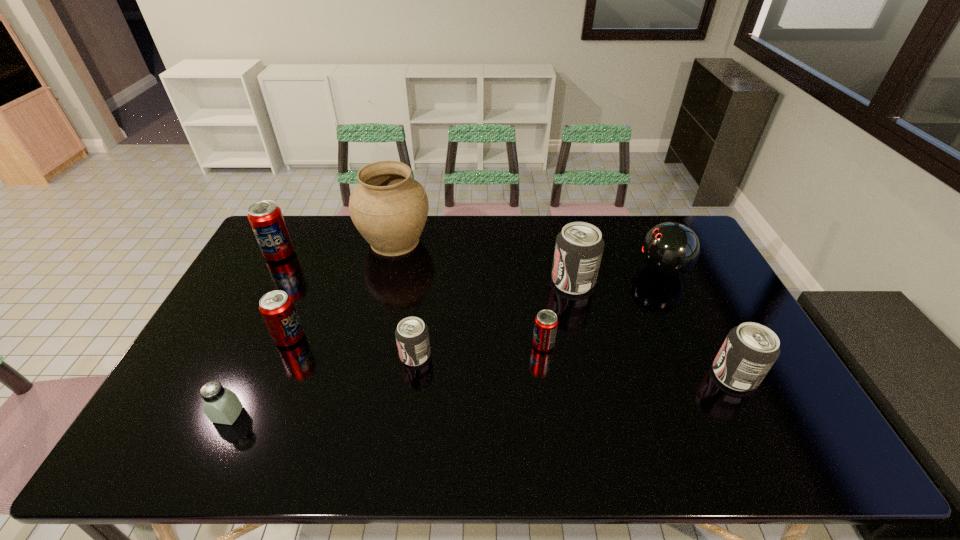
Image resolution: width=960 pixels, height=540 pixels. Find the location of `vacant area at the near left corner`. vacant area at the near left corner is located at coordinates [148, 441].

The width and height of the screenshot is (960, 540). In order to click on free space between the leftmost red soda can and the fourth soda can from right to left in this screenshot , I will do `click(348, 305)`.

Identify the location of free space between the leftmost soda can and the nearest object. This screenshot has width=960, height=540. (253, 334).

Identify the location of free space between the leftmost soda can and the third soda can from right to left. This screenshot has width=960, height=540. (412, 300).

At what (x,y) coordinates should I click in order to perform the action: click on free space between the fifth soda can from right to left and the smallest black soda can. Please return your answer as a coordinate pair (x, y). The height and width of the screenshot is (540, 960). Looking at the image, I should click on (352, 346).

Find the location of a particular element. This screenshot has height=540, width=960. free spot between the second smallest red soda can and the black bowling ball is located at coordinates (476, 303).

You are a GUI agent. You are given a task and a screenshot of the screen. Output one action in this format:
    pyautogui.click(x=<x>, y=<y>)
    Task: Click on the unoccupied area between the second soda can from left to right and the nearest object
    The image size is (960, 540).
    Given the screenshot: What is the action you would take?
    pyautogui.click(x=259, y=376)

Locate an element on the screen. The height and width of the screenshot is (540, 960). free spot between the urn and the smallest black soda can is located at coordinates (405, 298).

The image size is (960, 540). Identify the location of free spot between the rightmost black soda can and the third object from left to right. (512, 356).

This screenshot has width=960, height=540. What are the coordinates of `free space between the smallest red soda can and the farthest red soda can` in the screenshot? It's located at (412, 300).